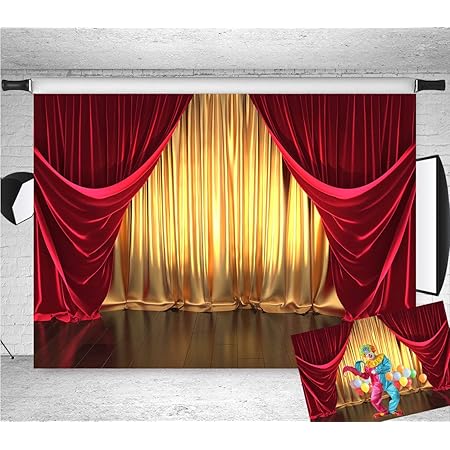
The width and height of the screenshot is (450, 450). Find the location of `handle`. handle is located at coordinates (11, 83).